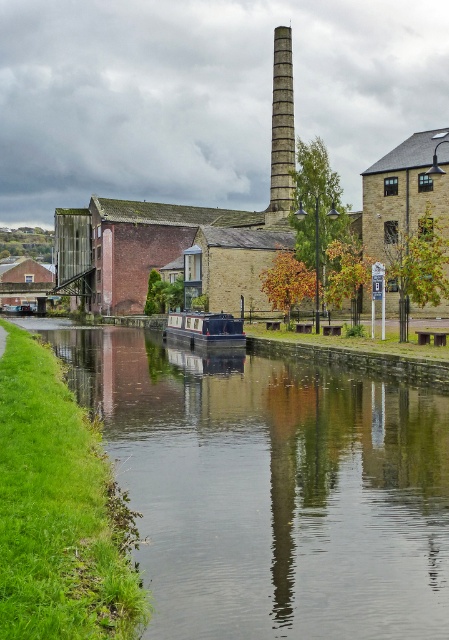
Is stone chimney at center to the left of polished dark blue boat at center from the viewer's perspective?

No, stone chimney at center is not to the left of polished dark blue boat at center.

The image size is (449, 640). I want to click on stone chimney at center, so click(x=281, y=129).

Does smooth concrete canal at center have a greater height compared to stone chimney at center?

No, smooth concrete canal at center is not taller than stone chimney at center.

Is smooth concrete canal at center shorter than stone chimney at center?

Yes, smooth concrete canal at center is shorter than stone chimney at center.

Between point (413, 396) and point (278, 88), which one is positioned in front?

Positioned in front is point (413, 396).

Image resolution: width=449 pixels, height=640 pixels. In order to click on smooth concrete canal at center in this screenshot , I will do `click(271, 488)`.

Who is more distant from viewer, (350,477) or (170,317)?

The point (170,317) is behind.

Who is positioned more to the left, smooth concrete canal at center or polished dark blue boat at center?

From the viewer's perspective, polished dark blue boat at center appears more on the left side.

Does point (397, 538) come farther from viewer compared to point (224, 346)?

No, it is in front of (224, 346).

Find the location of a particular element. The width and height of the screenshot is (449, 640). smooth concrete canal at center is located at coordinates (271, 488).